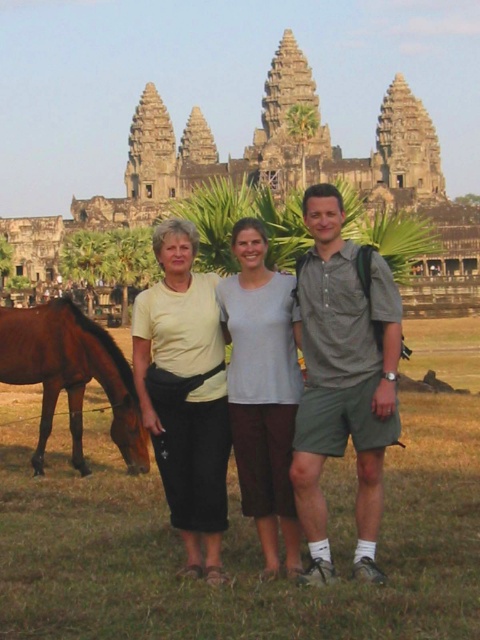
You are a photographer trying to capture a photo of the temple. You notice two items at the center of your viewfinder, the yellow fabric at center and the light gray cotton shirt at center. Which one should you focus on if you want to capture the larger object in your shot?

The yellow fabric at center is bigger than the light gray cotton shirt at center, so you should focus on the yellow fabric at center to capture the larger object in your shot.